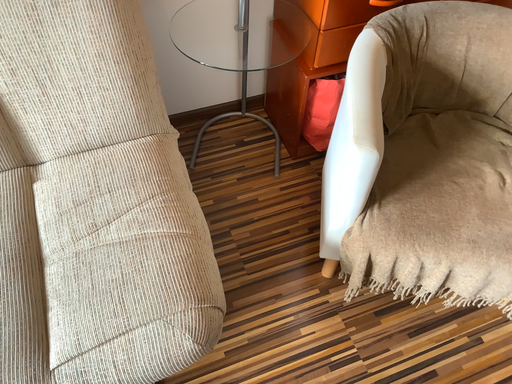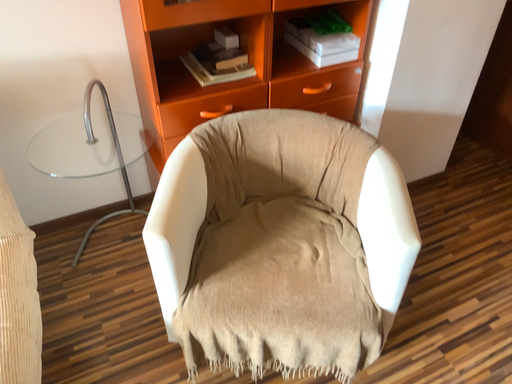
Question: Which way did the camera rotate in the video?

Choices:
 (A) rotated downward
 (B) rotated upward

Answer: (B)